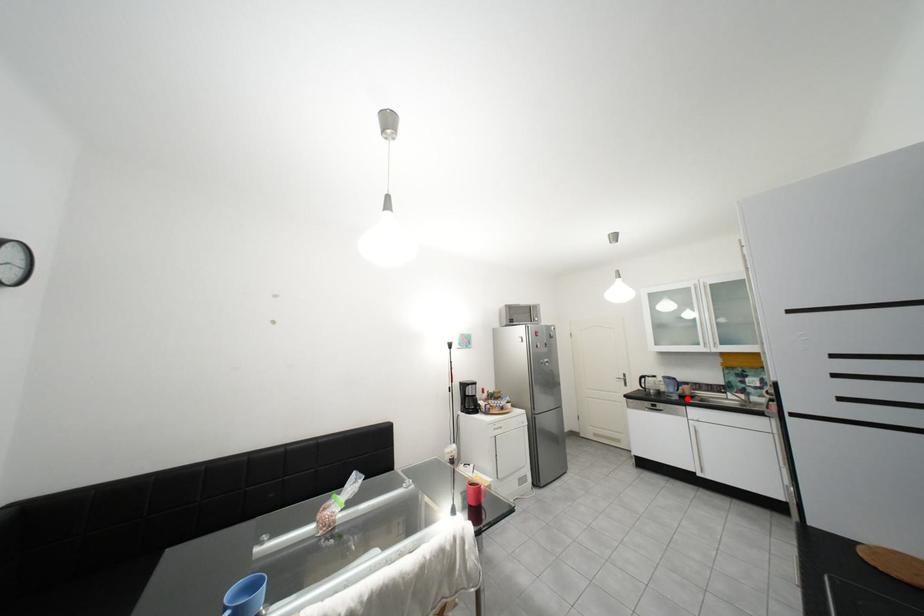
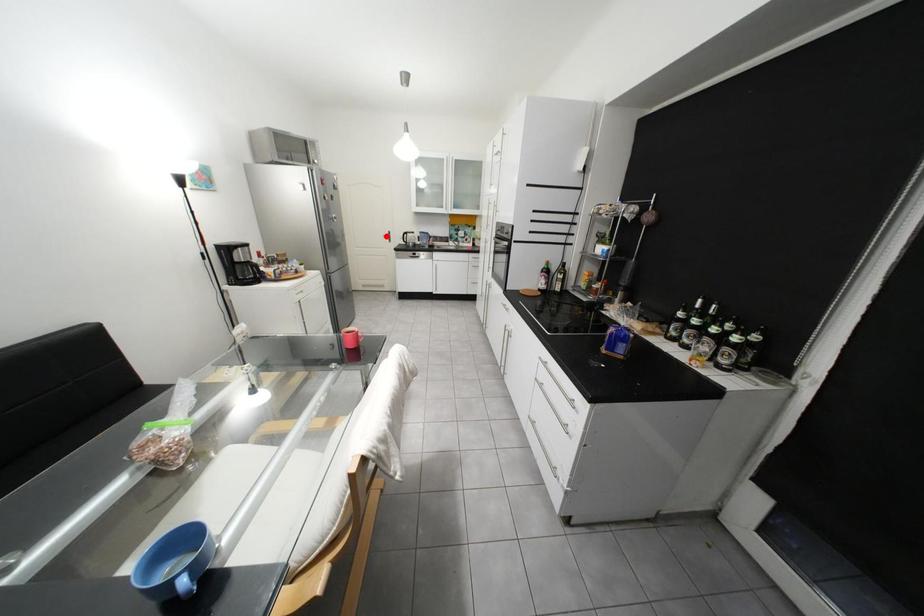
Consider the image. I am providing you with two images of the same scene from different viewpoints. A red point is marked on the first image and another point is marked on the second image. Is the red point in image1 aligned with the point shown in image2?

No